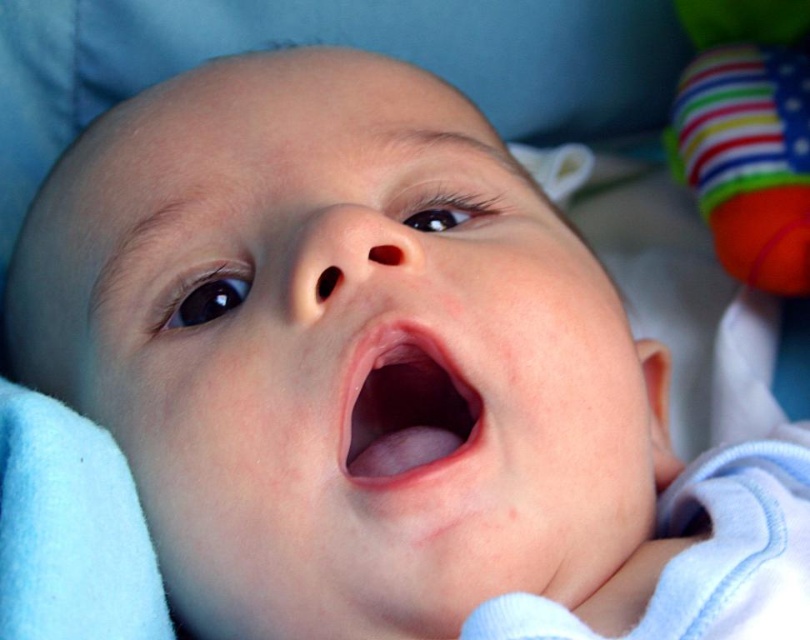
Question: Is multicolored fabric ball at upper right bigger than pink smooth flesh at center?

Choices:
 (A) no
 (B) yes

Answer: (B)

Question: Which point is closer to the camera?

Choices:
 (A) pink smooth flesh at center
 (B) multicolored fabric ball at upper right

Answer: (A)

Question: Where is multicolored fabric ball at upper right located in relation to pink smooth flesh at center in the image?

Choices:
 (A) above
 (B) below

Answer: (A)

Question: Among these objects, which one is nearest to the camera?

Choices:
 (A) pink smooth flesh at center
 (B) multicolored fabric ball at upper right

Answer: (A)

Question: Is multicolored fabric ball at upper right further to camera compared to pink smooth flesh at center?

Choices:
 (A) no
 (B) yes

Answer: (B)